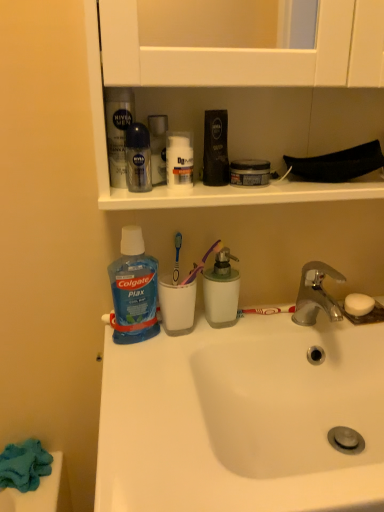
Locate an element on the screen. This screenshot has height=512, width=384. matte black shaving cream at upper center, acting as the 2th toiletry starting from the left is located at coordinates (215, 148).

This screenshot has height=512, width=384. What are the coordinates of `purple plastic toothbrush at center, positioned as the 2th toothbrush in right-to-left order` in the screenshot? It's located at (202, 263).

This screenshot has height=512, width=384. Describe the element at coordinates (202, 263) in the screenshot. I see `purple plastic toothbrush at center, positioned as the 2th toothbrush in right-to-left order` at that location.

Describe the element at coordinates (358, 304) in the screenshot. I see `white matte soap at right` at that location.

In order to face translucent plastic mouthwash at center, arranged as the third mouthwash when viewed from the left, should I rotate leftwards or rightwards?

You should rotate right by 4.161 degrees.

Find the location of a particular element. This screenshot has height=512, width=384. soft cotton towel at lower left is located at coordinates (41, 492).

What do you see at coordinates (249, 172) in the screenshot? I see `matte plastic mouthwash at upper center, which is the 4th mouthwash in left-to-right order` at bounding box center [249, 172].

Locate an element on the screen. The width and height of the screenshot is (384, 512). matte black shaving cream at upper center, acting as the 2th toiletry starting from the left is located at coordinates [x=215, y=148].

Considering the relative positions of purple plastic toothbrush at center, placed as the second toothbrush when sorted from left to right, and blue translucent liquid at lower left in the image provided, is purple plastic toothbrush at center, placed as the second toothbrush when sorted from left to right, to the right of blue translucent liquid at lower left from the viewer's perspective?

Yes, purple plastic toothbrush at center, placed as the second toothbrush when sorted from left to right, is to the right of blue translucent liquid at lower left.

From a real-world perspective, is purple plastic toothbrush at center, placed as the second toothbrush when sorted from left to right, under blue translucent liquid at lower left?

No.

Considering the positions of points (195, 269) and (143, 291), is point (195, 269) farther from camera compared to point (143, 291)?

Yes, point (195, 269) is farther from viewer.

Which of these two, purple plastic toothbrush at center, placed as the second toothbrush when sorted from left to right, or blue translucent liquid at lower left, stands shorter?

purple plastic toothbrush at center, placed as the second toothbrush when sorted from left to right.

In the scene shown: From a real-world perspective, is blue plastic toothbrush at center, which is the 1th toothbrush from left to right, under matte black shaving cream at upper center, acting as the 2th toiletry starting from the left?

Indeed, from a real-world perspective, blue plastic toothbrush at center, which is the 1th toothbrush from left to right, is positioned beneath matte black shaving cream at upper center, acting as the 2th toiletry starting from the left.

Starting from the blue plastic toothbrush at center, which is the 1th toothbrush from left to right, which toiletry is the 2nd one to the right? Please provide its 2D coordinates.

[(215, 148)]

Would you say blue plastic toothbrush at center, which is the third toothbrush from right to left, is a long distance from matte black shaving cream at upper center, placed as the first toiletry when sorted from right to left?

That's not correct — blue plastic toothbrush at center, which is the third toothbrush from right to left, is a little close to matte black shaving cream at upper center, placed as the first toiletry when sorted from right to left.

Based on the photo, can you confirm if blue plastic toothbrush at center, which is the third toothbrush from right to left, is bigger than matte black shaving cream at upper center, acting as the 2th toiletry starting from the left?

No.

Is translucent plastic mouthwash at center, arranged as the third mouthwash when viewed from the left, shorter than white ceramic sink at center, the 2th sink from the bottom?

In fact, translucent plastic mouthwash at center, arranged as the third mouthwash when viewed from the left, may be taller than white ceramic sink at center, the 2th sink from the bottom.

Find the location of a particular element. This screenshot has width=384, height=512. the 1st sink positioned below the translucent plastic mouthwash at center, the 2th mouthwash in the right-to-left sequence (from the image's perspective) is located at coordinates (291, 395).

Would you consider translucent plastic mouthwash at center, the 2th mouthwash in the right-to-left sequence, to be distant from white ceramic sink at center, acting as the 1th sink starting from the top?

No.

Is white matte jar at upper center, the 2th toiletry when ordered from right to left, to the left or to the right of white matte soap at right in the image?

white matte jar at upper center, the 2th toiletry when ordered from right to left, is positioned on white matte soap at right's left side.

Is white matte jar at upper center, acting as the first toiletry starting from the left, wider than white matte soap at right?

In fact, white matte jar at upper center, acting as the first toiletry starting from the left, might be narrower than white matte soap at right.

Is point (177, 172) positioned after point (355, 309)?

No, (177, 172) is in front of (355, 309).

Can you see white matte jar at upper center, the 2th toiletry when ordered from right to left, touching white matte soap at right?

No, white matte jar at upper center, the 2th toiletry when ordered from right to left, is not touching white matte soap at right.

Could translucent plastic mouthwash at center, arranged as the third mouthwash when viewed from the left, be considered to be inside white plastic toothbrush at sink, which ranks as the 1th toothbrush in right-to-left order?

No, translucent plastic mouthwash at center, arranged as the third mouthwash when viewed from the left, is located outside of white plastic toothbrush at sink, which ranks as the 1th toothbrush in right-to-left order.

Is white plastic toothbrush at sink, which is the 3th toothbrush in left-to-right order, positioned far away from translucent plastic mouthwash at center, arranged as the third mouthwash when viewed from the left?

No, white plastic toothbrush at sink, which is the 3th toothbrush in left-to-right order, is in close proximity to translucent plastic mouthwash at center, arranged as the third mouthwash when viewed from the left.

From a real-world perspective, between white plastic toothbrush at sink, which ranks as the 1th toothbrush in right-to-left order, and translucent plastic mouthwash at center, the 2th mouthwash in the right-to-left sequence, who is vertically higher?

translucent plastic mouthwash at center, the 2th mouthwash in the right-to-left sequence, is physically above.

Is white plastic toothbrush at sink, which is the 3th toothbrush in left-to-right order, wider or thinner than translucent plastic mouthwash at center, arranged as the third mouthwash when viewed from the left?

In the image, white plastic toothbrush at sink, which is the 3th toothbrush in left-to-right order, appears to be more narrow than translucent plastic mouthwash at center, arranged as the third mouthwash when viewed from the left.

How many degrees apart are the facing directions of white ceramic sink at center, positioned as the second sink in top-to-bottom order, and purple plastic toothbrush at center, placed as the second toothbrush when sorted from left to right?

There is a 1.79-degree angle between the facing directions of white ceramic sink at center, positioned as the second sink in top-to-bottom order, and purple plastic toothbrush at center, placed as the second toothbrush when sorted from left to right.

Can purple plastic toothbrush at center, positioned as the 2th toothbrush in right-to-left order, be found inside white ceramic sink at center, positioned as the second sink in top-to-bottom order?

No, white ceramic sink at center, positioned as the second sink in top-to-bottom order, does not contain purple plastic toothbrush at center, positioned as the 2th toothbrush in right-to-left order.

From the image's perspective, would you say white ceramic sink at center, which ranks as the 1th sink in bottom-to-top order, is shown under purple plastic toothbrush at center, placed as the second toothbrush when sorted from left to right?

Yes.

In terms of size, does white ceramic sink at center, which ranks as the 1th sink in bottom-to-top order, appear bigger or smaller than purple plastic toothbrush at center, placed as the second toothbrush when sorted from left to right?

white ceramic sink at center, which ranks as the 1th sink in bottom-to-top order, is bigger than purple plastic toothbrush at center, placed as the second toothbrush when sorted from left to right.

From their relative heights in the image, would you say purple plastic toothbrush at center, placed as the second toothbrush when sorted from left to right, is taller or shorter than matte black shaving cream at upper center, placed as the first toiletry when sorted from right to left?

In the image, purple plastic toothbrush at center, placed as the second toothbrush when sorted from left to right, appears to be shorter than matte black shaving cream at upper center, placed as the first toiletry when sorted from right to left.

Considering the relative sizes of purple plastic toothbrush at center, placed as the second toothbrush when sorted from left to right, and matte black shaving cream at upper center, placed as the first toiletry when sorted from right to left, in the image provided, is purple plastic toothbrush at center, placed as the second toothbrush when sorted from left to right, wider than matte black shaving cream at upper center, placed as the first toiletry when sorted from right to left,?

Indeed, purple plastic toothbrush at center, placed as the second toothbrush when sorted from left to right, has a greater width compared to matte black shaving cream at upper center, placed as the first toiletry when sorted from right to left.

Could you tell me if purple plastic toothbrush at center, placed as the second toothbrush when sorted from left to right, is turned towards matte black shaving cream at upper center, acting as the 2th toiletry starting from the left?

No, purple plastic toothbrush at center, placed as the second toothbrush when sorted from left to right, is not facing towards matte black shaving cream at upper center, acting as the 2th toiletry starting from the left.

Based on their positions, is purple plastic toothbrush at center, placed as the second toothbrush when sorted from left to right, located to the left or right of matte black shaving cream at upper center, placed as the first toiletry when sorted from right to left?

purple plastic toothbrush at center, placed as the second toothbrush when sorted from left to right, is positioned on matte black shaving cream at upper center, placed as the first toiletry when sorted from right to left,'s left side.

Where is `the 1st toothbrush behind when counting from the blue translucent liquid at lower left`? The width and height of the screenshot is (384, 512). the 1st toothbrush behind when counting from the blue translucent liquid at lower left is located at coordinates (202, 263).

This screenshot has height=512, width=384. I want to click on the 2nd toiletry above the blue plastic toothbrush at center, which is the 1th toothbrush from left to right (from the image's perspective), so click(x=215, y=148).

From the image, which object appears to be farther from purple plastic toothbrush at center, positioned as the 2th toothbrush in right-to-left order, white plastic toothbrush at sink, which is the 3th toothbrush in left-to-right order, or blue translucent liquid at lower left?

white plastic toothbrush at sink, which is the 3th toothbrush in left-to-right order, is positioned further to the anchor purple plastic toothbrush at center, positioned as the 2th toothbrush in right-to-left order.

Considering their positions, is translucent plastic mouthwash at center, arranged as the third mouthwash when viewed from the left, positioned closer to blue translucent liquid at lower left than white ceramic sink at center, positioned as the second sink in top-to-bottom order?

The object closer to blue translucent liquid at lower left is translucent plastic mouthwash at center, arranged as the third mouthwash when viewed from the left.

Which object lies nearer to the anchor point clear plastic bottle at upper center, placed as the second mouthwash when sorted from left to right, white ceramic sink at center, acting as the 1th sink starting from the top, or blue glossy mouthwash at upper center, which is the 4th mouthwash from right to left?

blue glossy mouthwash at upper center, which is the 4th mouthwash from right to left, lies closer to clear plastic bottle at upper center, placed as the second mouthwash when sorted from left to right, than the other object.

Looking at this image, considering their positions, is white matte jar at upper center, the 2th toiletry when ordered from right to left, positioned further to blue translucent liquid at lower left than blue glossy mouthwash at upper center, which is the 4th mouthwash from right to left?

white matte jar at upper center, the 2th toiletry when ordered from right to left.

Based on their spatial positions, is translucent plastic mouthwash at center, the 2th mouthwash in the right-to-left sequence, or white matte soap at right further from blue plastic toothbrush at center, which is the 1th toothbrush from left to right?

Based on the image, white matte soap at right appears to be further to blue plastic toothbrush at center, which is the 1th toothbrush from left to right.

Which object lies nearer to the anchor point translucent plastic mouthwash at center, the 2th mouthwash in the right-to-left sequence, matte plastic mouthwash at upper center, which is the 4th mouthwash in left-to-right order, or white plastic toothbrush at sink, which ranks as the 1th toothbrush in right-to-left order?

white plastic toothbrush at sink, which ranks as the 1th toothbrush in right-to-left order, is closer to translucent plastic mouthwash at center, the 2th mouthwash in the right-to-left sequence.

Based on their spatial positions, is white matte jar at upper center, acting as the first toiletry starting from the left, or matte black shaving cream at upper center, acting as the 2th toiletry starting from the left, further from clear plastic bottle at upper center, placed as the second mouthwash when sorted from left to right?

Among the two, matte black shaving cream at upper center, acting as the 2th toiletry starting from the left, is located further to clear plastic bottle at upper center, placed as the second mouthwash when sorted from left to right.

Based on their spatial positions, is white ceramic sink at center, which ranks as the 1th sink in bottom-to-top order, or matte plastic mouthwash at upper center, the 1th mouthwash when ordered from right to left, further from white matte jar at upper center, the 2th toiletry when ordered from right to left?

white ceramic sink at center, which ranks as the 1th sink in bottom-to-top order.

Find the location of a particular element. The width and height of the screenshot is (384, 512). toiletry situated between white matte jar at upper center, the 2th toiletry when ordered from right to left, and white matte soap at right from left to right is located at coordinates (215, 148).

Where is `sink between blue glossy mouthwash at upper center, which appears as the 1th mouthwash when viewed from the left, and white ceramic sink at center, positioned as the second sink in top-to-bottom order, from top to bottom`? sink between blue glossy mouthwash at upper center, which appears as the 1th mouthwash when viewed from the left, and white ceramic sink at center, positioned as the second sink in top-to-bottom order, from top to bottom is located at coordinates (291, 395).

Where is `soap between matte black shaving cream at upper center, placed as the first toiletry when sorted from right to left, and white ceramic sink at center, acting as the 1th sink starting from the top, in the vertical direction`? The width and height of the screenshot is (384, 512). soap between matte black shaving cream at upper center, placed as the first toiletry when sorted from right to left, and white ceramic sink at center, acting as the 1th sink starting from the top, in the vertical direction is located at coordinates (358, 304).

At what (x,y) coordinates should I click in order to perform the action: click on toiletry between blue glossy mouthwash at upper center, which appears as the 1th mouthwash when viewed from the left, and white plastic toothbrush at sink, which ranks as the 1th toothbrush in right-to-left order, vertically. Please return your answer as a coordinate pair (x, y). This screenshot has height=512, width=384. Looking at the image, I should click on (179, 161).